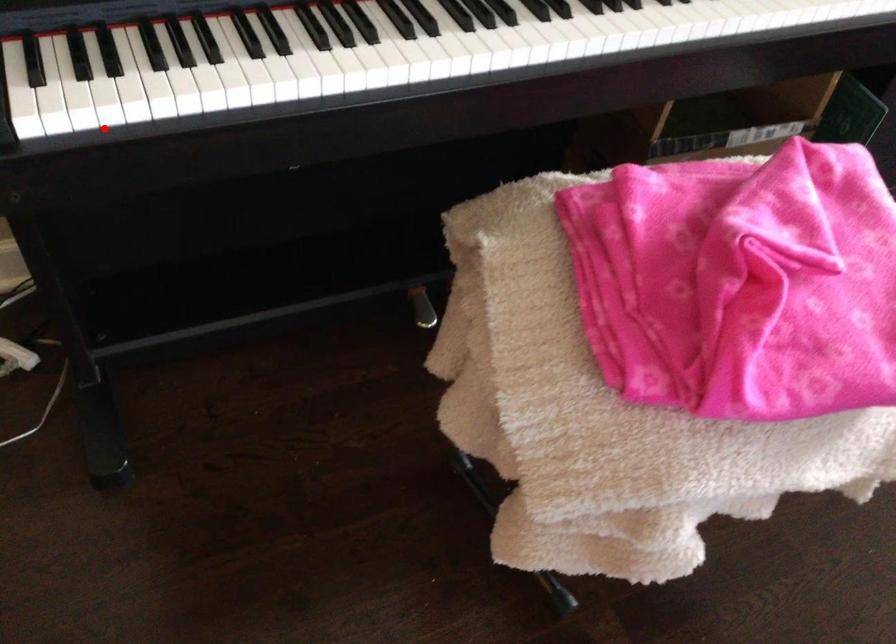
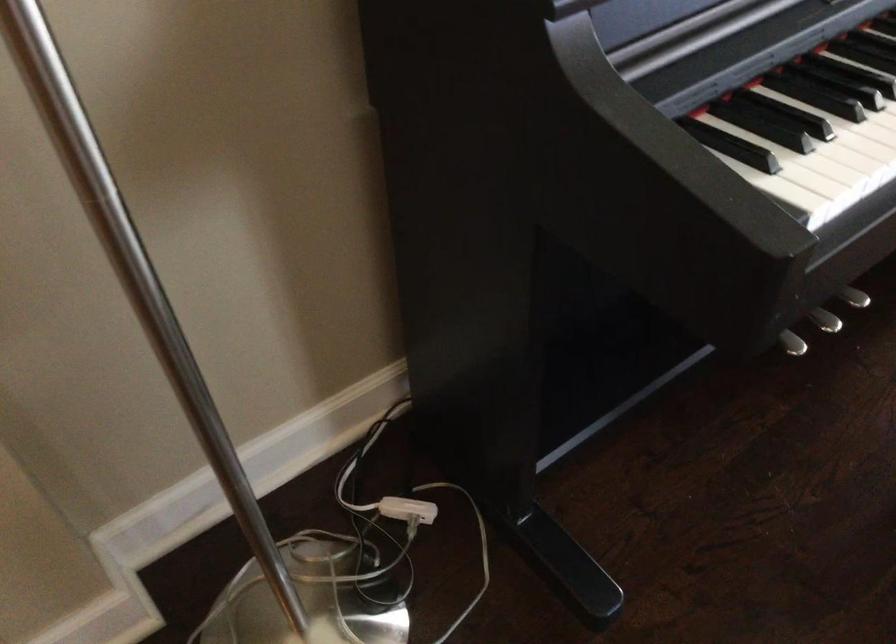
The point at the highlighted location is marked in the first image. Where is the corresponding point in the second image?

(851, 196)